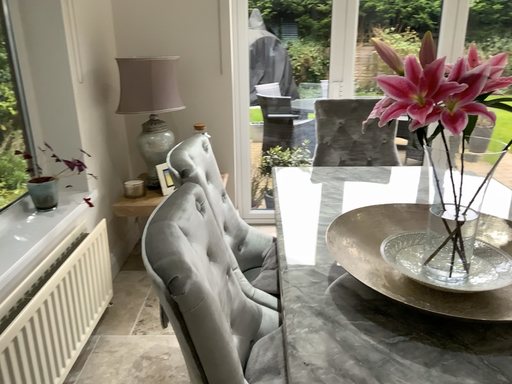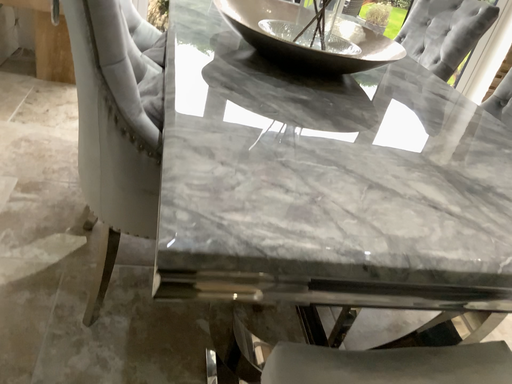
Question: How did the camera likely rotate when shooting the video?

Choices:
 (A) rotated left
 (B) rotated right

Answer: (B)